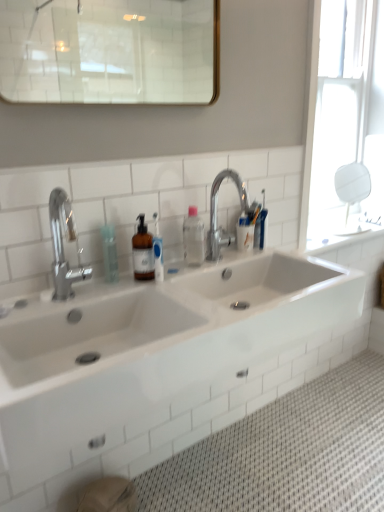
You are a GUI agent. You are given a task and a screenshot of the screen. Output one action in this format:
    pyautogui.click(x=<x>, y=<y>)
    Task: Click on the vacant space to the right of transparent plastic bottle at center
    The width and height of the screenshot is (384, 512).
    Given the screenshot: What is the action you would take?
    pyautogui.click(x=237, y=259)